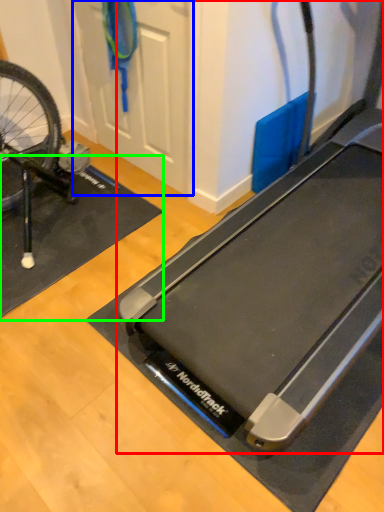
Question: Which object is positioned farthest from treadmill (highlighted by a red box)? Select from door (highlighted by a blue box) and yoga mat (highlighted by a green box).

Choices:
 (A) door
 (B) yoga mat

Answer: (A)